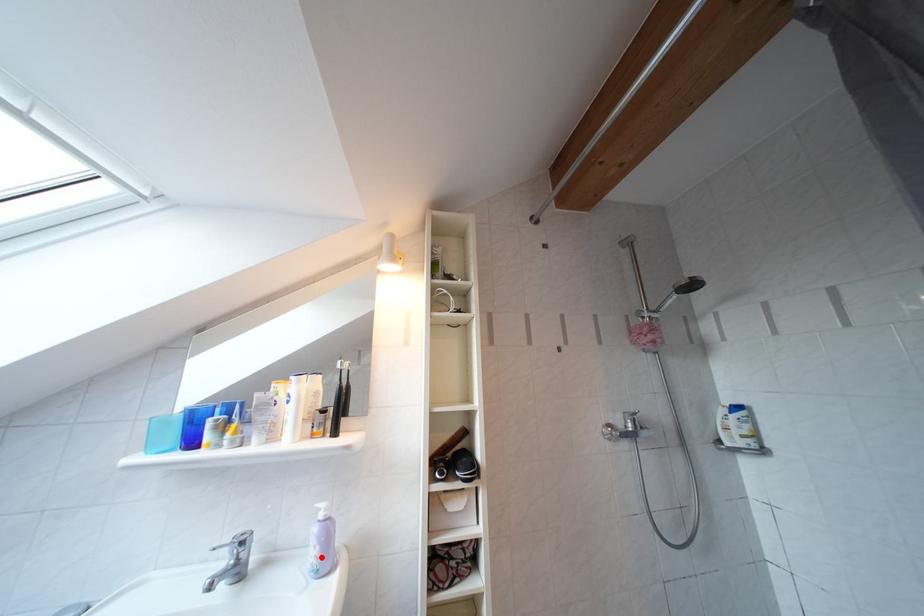
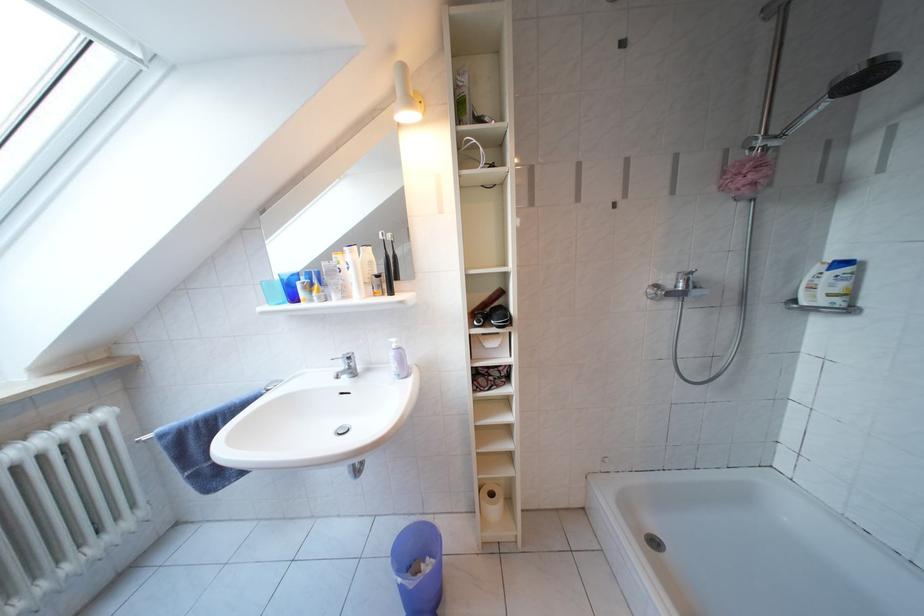
The point at the highlighted location is marked in the first image. Where is the corresponding point in the second image?

(402, 371)